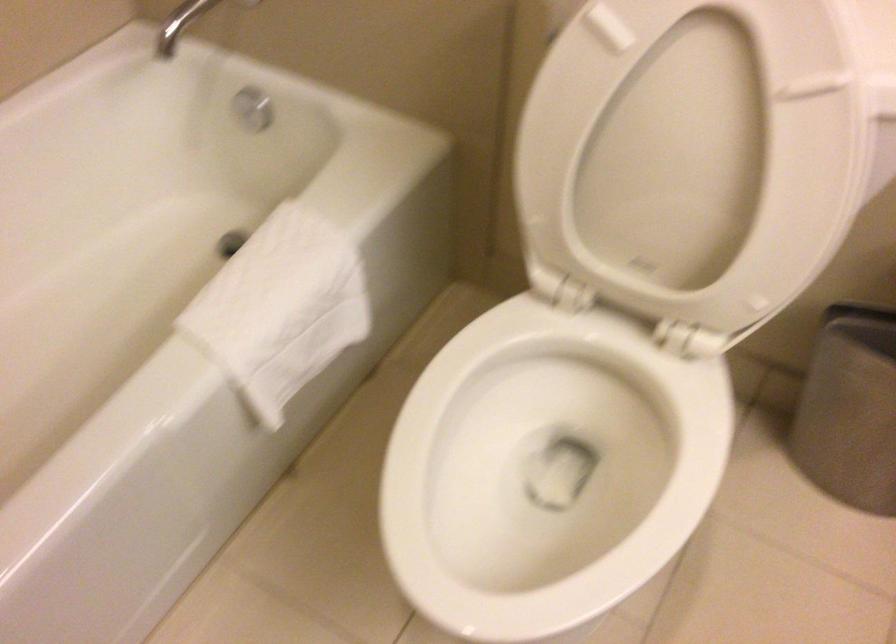
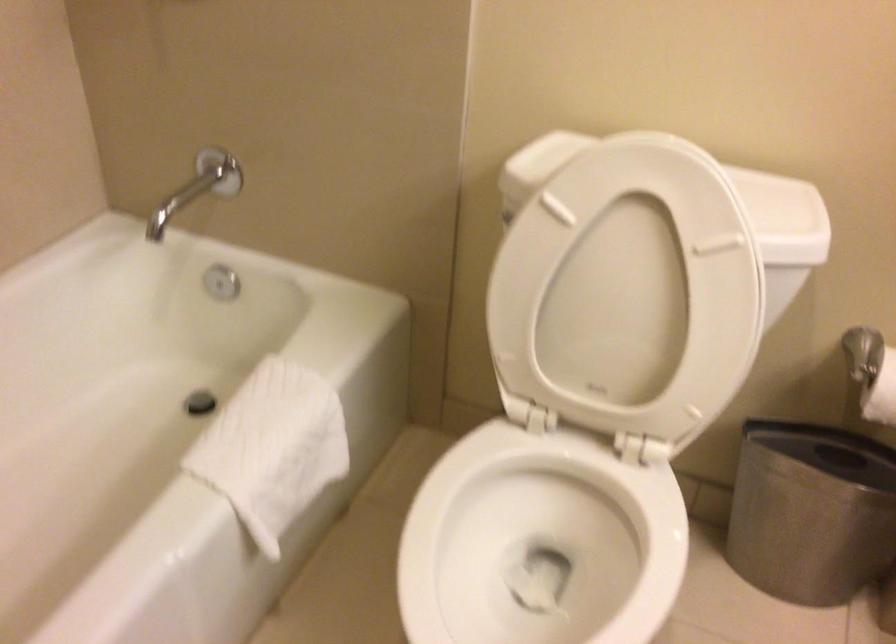
The point at (567, 427) is marked in the first image. Where is the corresponding point in the second image?

(539, 542)